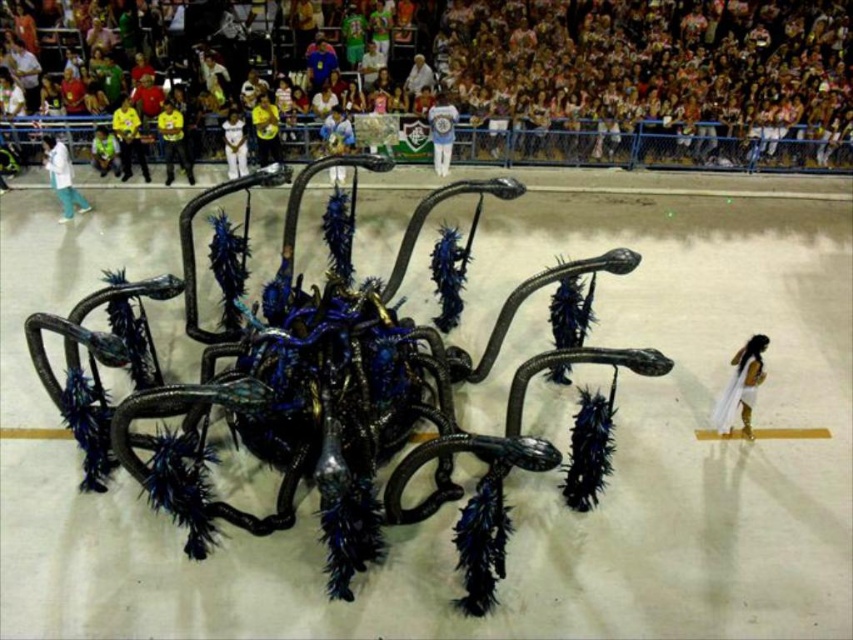
Can you confirm if white silk dress at lower right is positioned to the left of yellow fabric shirt at center?

Incorrect, white silk dress at lower right is not on the left side of yellow fabric shirt at center.

Is white silk dress at lower right wider than yellow fabric shirt at center?

In fact, white silk dress at lower right might be narrower than yellow fabric shirt at center.

Identify the location of white silk dress at lower right. The image size is (853, 640). (741, 385).

I want to click on white silk dress at lower right, so click(741, 385).

From the picture: Does metallic blue spider at center have a larger size compared to yellow fabric shirt at center?

Actually, metallic blue spider at center might be smaller than yellow fabric shirt at center.

Find the location of a particular element. Image resolution: width=853 pixels, height=640 pixels. metallic blue spider at center is located at coordinates (315, 392).

At what (x,y) coordinates should I click in order to perform the action: click on metallic blue spider at center. Please return your answer as a coordinate pair (x, y). Looking at the image, I should click on (315, 392).

Which is more to the left, yellow fabric at upper left or white fabric dress at center?

Positioned to the left is yellow fabric at upper left.

You are a GUI agent. You are given a task and a screenshot of the screen. Output one action in this format:
    pyautogui.click(x=<x>, y=<y>)
    Task: Click on the yellow fabric at upper left
    The image size is (853, 640).
    Given the screenshot: What is the action you would take?
    pyautogui.click(x=128, y=140)